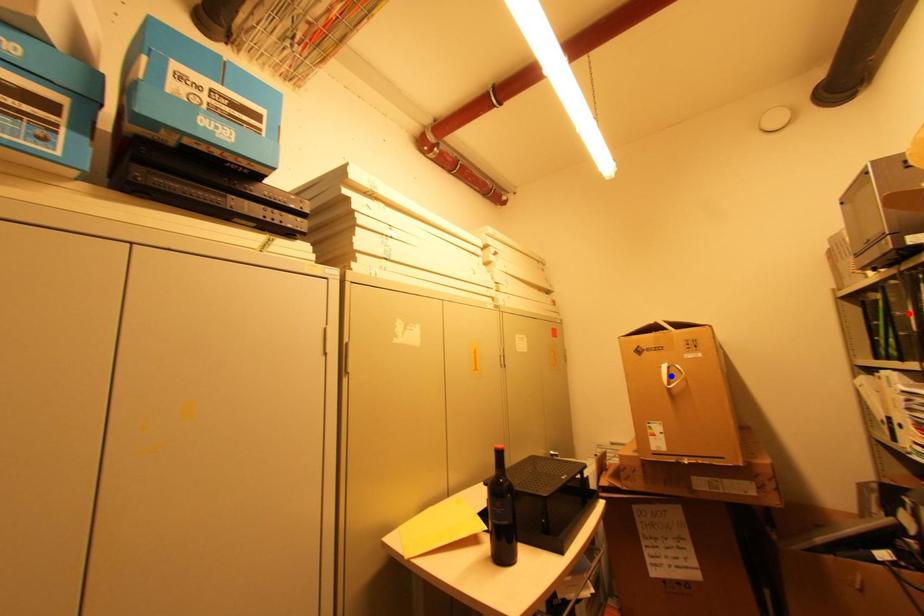
Question: In the image, two points are highlighted. Which point is nearer to the camera? Reply with the corresponding letter.

Choices:
 (A) blue point
 (B) red point

Answer: (B)